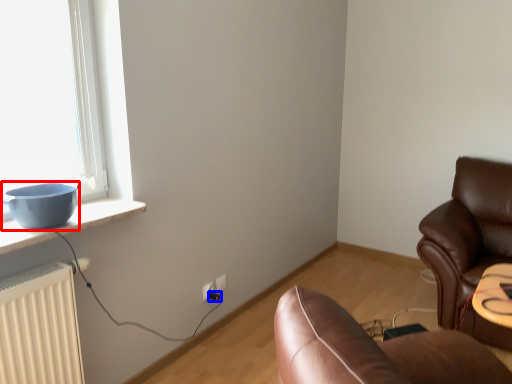
Question: Which of the following is the closest to the observer, bowl (highlighted by a red box) or plug (highlighted by a blue box)?

Choices:
 (A) bowl
 (B) plug

Answer: (A)